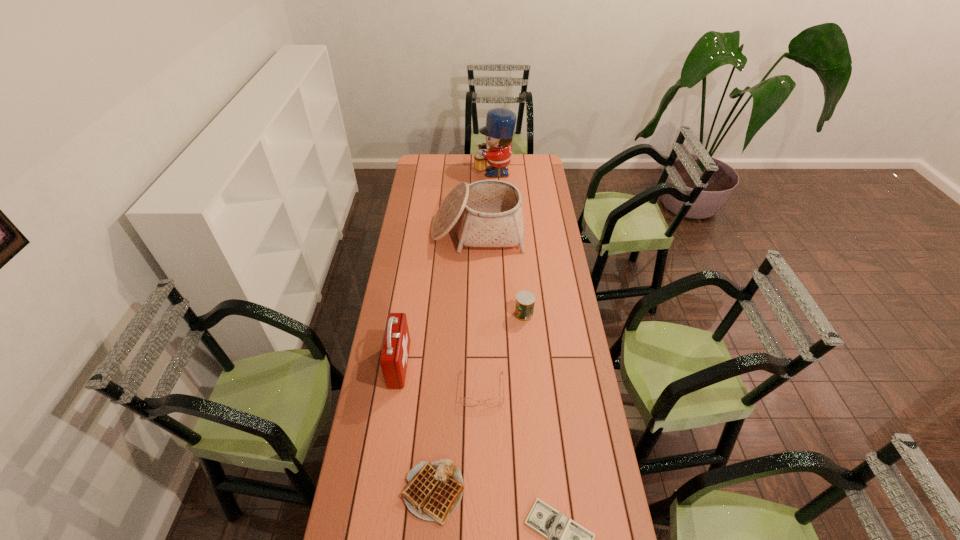
I want to click on the tallest object, so click(500, 123).

Where is `the farthest object`? The width and height of the screenshot is (960, 540). the farthest object is located at coordinates (500, 123).

Image resolution: width=960 pixels, height=540 pixels. I want to click on the sixth nearest object, so click(x=488, y=213).

Where is `the first-aid kit`? the first-aid kit is located at coordinates (395, 350).

Find the location of a particular element. can is located at coordinates (525, 300).

At what (x,y) coordinates should I click in order to perform the action: click on the fourth shortest object. Please return your answer as a coordinate pair (x, y). Looking at the image, I should click on (525, 300).

At what (x,y) coordinates should I click in order to perform the action: click on spectacles. Please return your answer as a coordinate pair (x, y). Looking at the image, I should click on (494, 402).

Identify the location of waffle. (434, 490).

Find the location of a particular element. blank area located on the front-facing side of the nutcracker is located at coordinates (426, 171).

You are a GUI agent. You are given a task and a screenshot of the screen. Output one action in this format:
    pyautogui.click(x=<x>, y=<y>)
    Task: Click on the vacant position located on the front-facing side of the nutcracker
    The height and width of the screenshot is (540, 960).
    Given the screenshot: What is the action you would take?
    pyautogui.click(x=416, y=171)